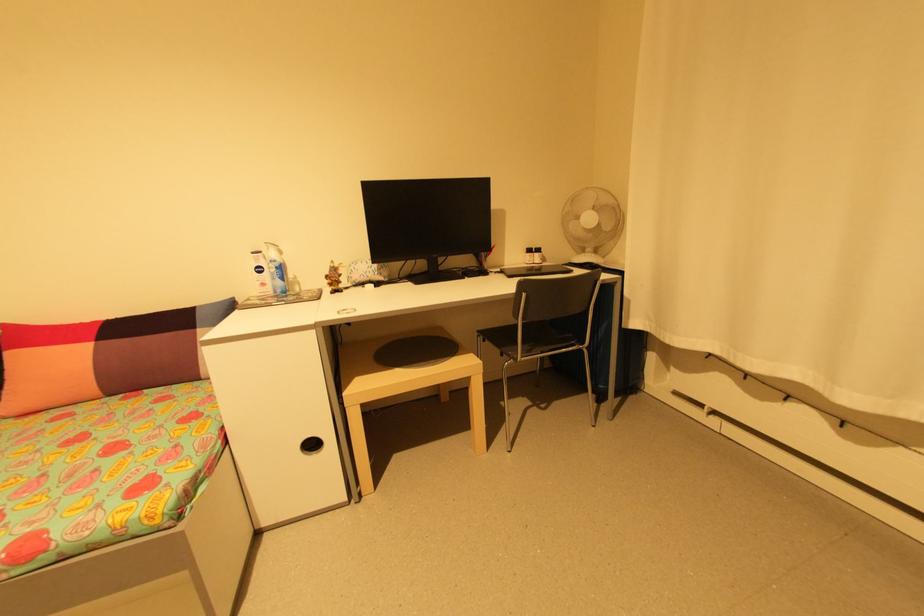
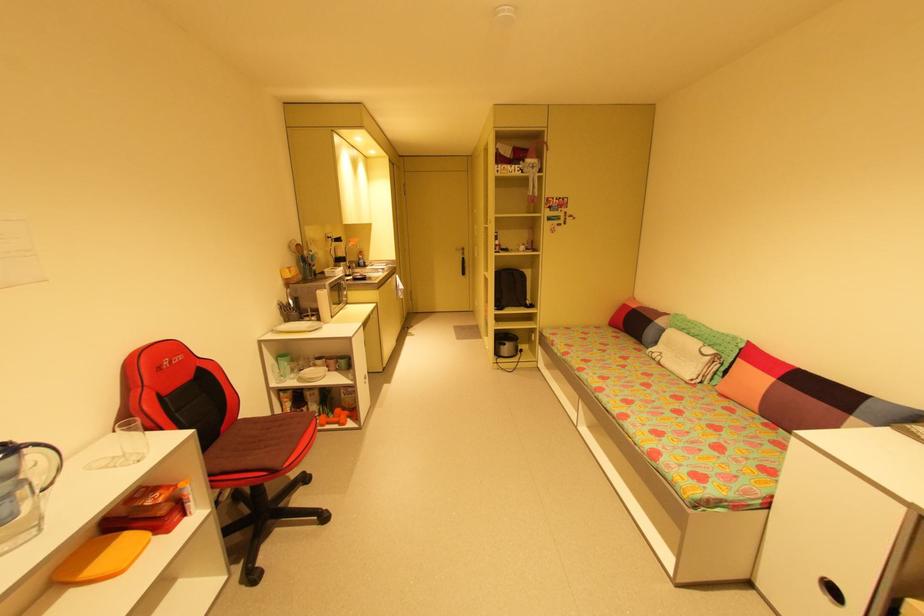
Find the pixel in the second image that matches [271,536] in the first image.

(758, 593)